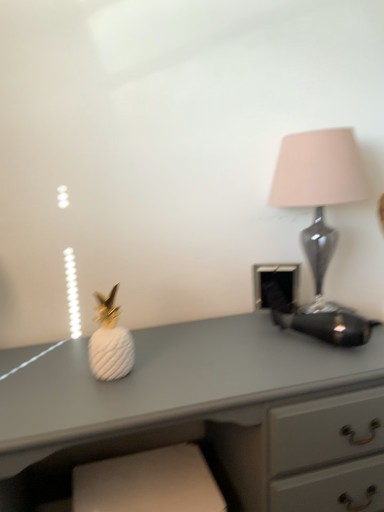
The height and width of the screenshot is (512, 384). I want to click on free space to the left of white matte pineapple at center, so click(x=48, y=374).